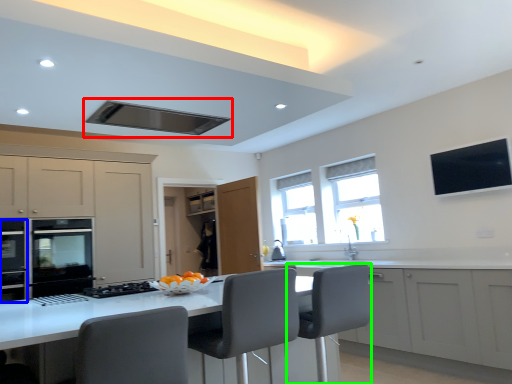
Question: Estimate the real-world distances between objects in this image. Which object is closer to exhaust hood (highlighted by a red box), appliance (highlighted by a blue box) or swivel chair (highlighted by a green box)?

Choices:
 (A) appliance
 (B) swivel chair

Answer: (B)